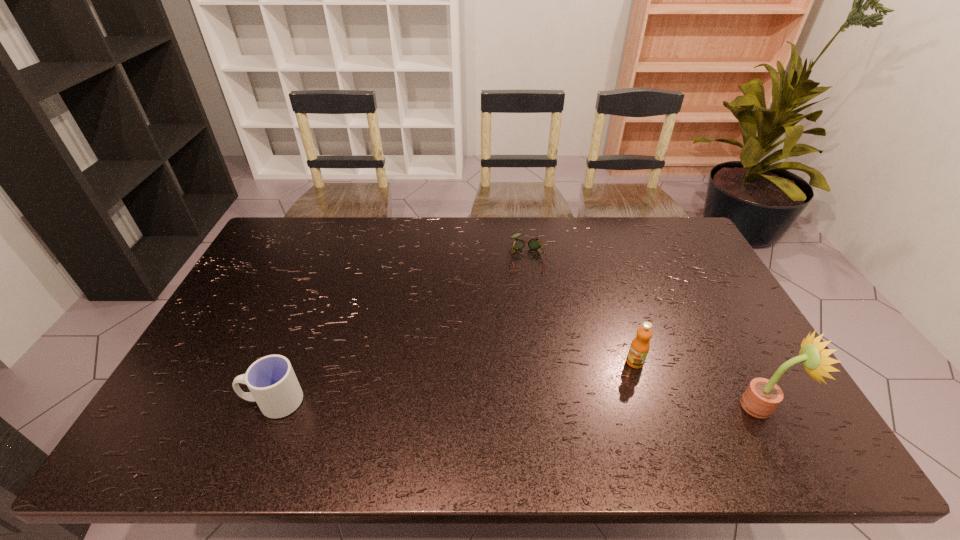
Identify the location of vacant position in the image that satisfies the following two spatial constraints: 1. on the front side of the second object from right to left; 2. on the face of the rightmost object. (649, 406).

The height and width of the screenshot is (540, 960). I want to click on free space that satisfies the following two spatial constraints: 1. on the front side of the rightmost object; 2. on the face of the third object from right to left, so click(546, 406).